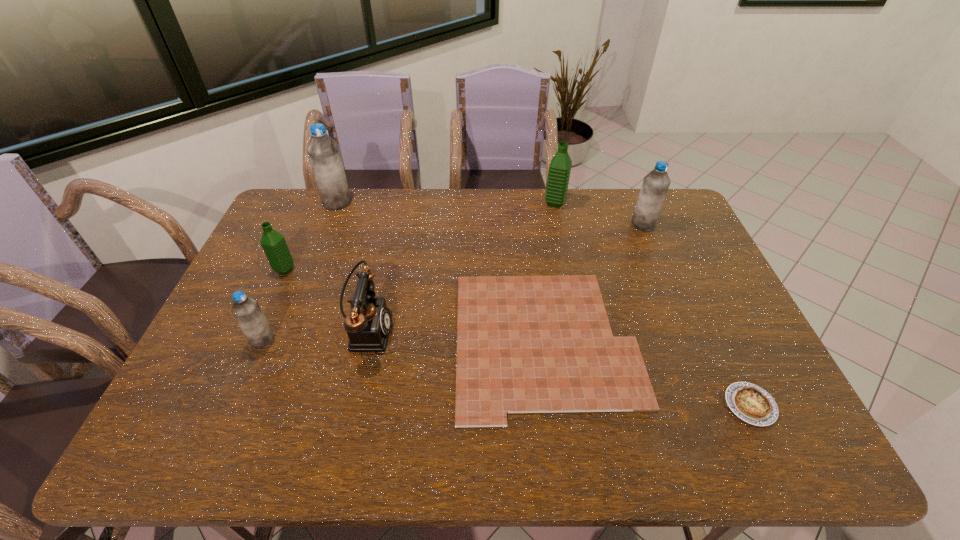
In order to click on vacant position in the image that satisfies the following two spatial constraints: 1. on the front of the shortest object at the rotary dial; 2. on the right side of the fifth object from right to left in this screenshot , I will do `click(364, 341)`.